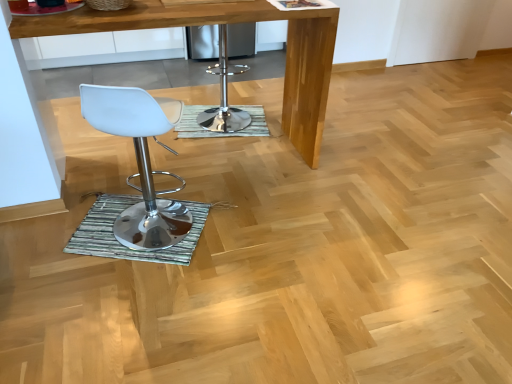
Question: From a real-world perspective, is wooden table at center below green textured mat at center, marked as the first mat in a back-to-front arrangement?

Choices:
 (A) yes
 (B) no

Answer: (B)

Question: Does wooden table at center have a lesser width compared to green textured mat at center, the second mat positioned from the front?

Choices:
 (A) yes
 (B) no

Answer: (B)

Question: Is wooden table at center at the right side of green textured mat at center, marked as the first mat in a back-to-front arrangement?

Choices:
 (A) yes
 (B) no

Answer: (B)

Question: Does wooden table at center have a lesser height compared to green textured mat at center, the second mat positioned from the front?

Choices:
 (A) no
 (B) yes

Answer: (A)

Question: Is wooden table at center positioned with its back to green textured mat at center, the 1th mat when ordered from top to bottom?

Choices:
 (A) yes
 (B) no

Answer: (B)

Question: From a real-world perspective, is wooden table at center physically located above or below white plastic stool at left?

Choices:
 (A) above
 (B) below

Answer: (A)

Question: Considering the positions of point (287, 104) and point (103, 91), is point (287, 104) closer or farther from the camera than point (103, 91)?

Choices:
 (A) farther
 (B) closer

Answer: (A)

Question: Which is correct: wooden table at center is inside white plastic stool at left, or outside of it?

Choices:
 (A) outside
 (B) inside

Answer: (A)

Question: From the image's perspective, is wooden table at center above or below white plastic stool at left?

Choices:
 (A) below
 (B) above

Answer: (B)

Question: In terms of width, does green textured mat at center, the 2th mat when ordered from back to front, look wider or thinner when compared to polished chrome bar stool at center?

Choices:
 (A) thin
 (B) wide

Answer: (A)

Question: Considering the positions of green textured mat at center, the 2th mat positioned from the top, and polished chrome bar stool at center in the image, is green textured mat at center, the 2th mat positioned from the top, bigger or smaller than polished chrome bar stool at center?

Choices:
 (A) big
 (B) small

Answer: (B)

Question: Is green textured mat at center, the 2th mat when ordered from back to front, situated inside polished chrome bar stool at center or outside?

Choices:
 (A) inside
 (B) outside

Answer: (B)

Question: From a real-world perspective, is green textured mat at center, which is counted as the first mat, starting from the bottom, above or below polished chrome bar stool at center?

Choices:
 (A) below
 (B) above

Answer: (A)

Question: Choose the correct answer: Is green textured mat at center, marked as the first mat in a back-to-front arrangement, inside white plastic stool at left or outside it?

Choices:
 (A) outside
 (B) inside

Answer: (A)

Question: Considering the relative positions of green textured mat at center, marked as the first mat in a back-to-front arrangement, and white plastic stool at left in the image provided, is green textured mat at center, marked as the first mat in a back-to-front arrangement, to the left or to the right of white plastic stool at left?

Choices:
 (A) right
 (B) left

Answer: (A)